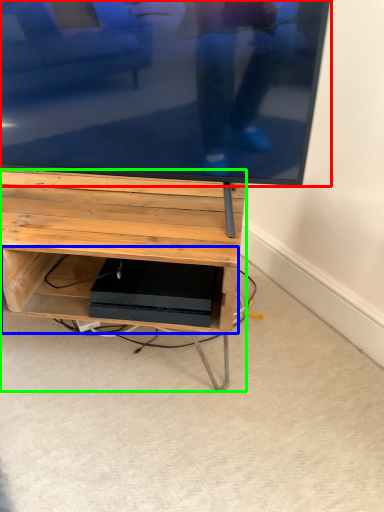
Question: Estimate the real-world distances between objects in this image. Which object is farther from television (highlighted by a red box), shelf (highlighted by a blue box) or furniture (highlighted by a green box)?

Choices:
 (A) shelf
 (B) furniture

Answer: (A)